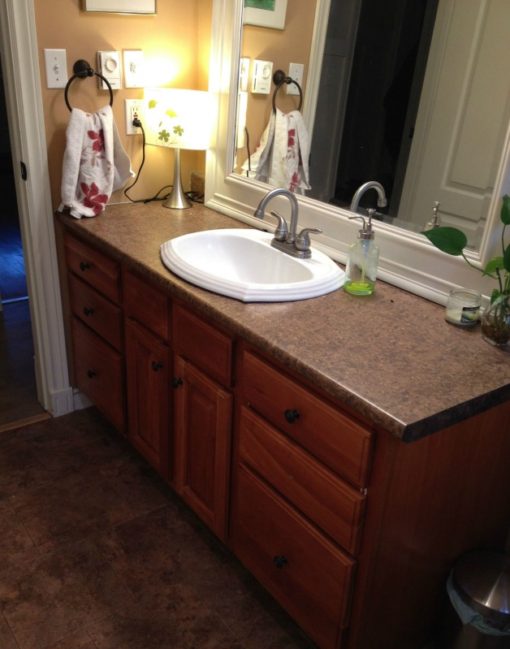
You are a GUI agent. You are given a task and a screenshot of the screen. Output one action in this format:
    pyautogui.click(x=<x>, y=<y>)
    Task: Click on the tile floor
    The width and height of the screenshot is (510, 649).
    Given the screenshot: What is the action you would take?
    pyautogui.click(x=98, y=509)